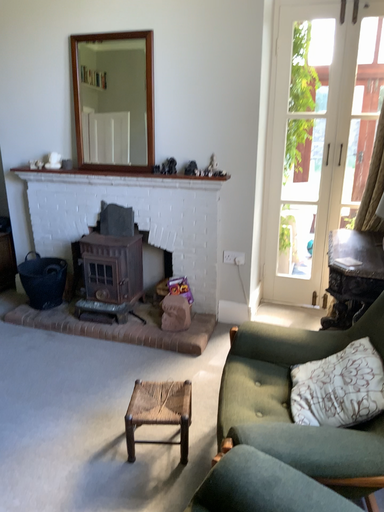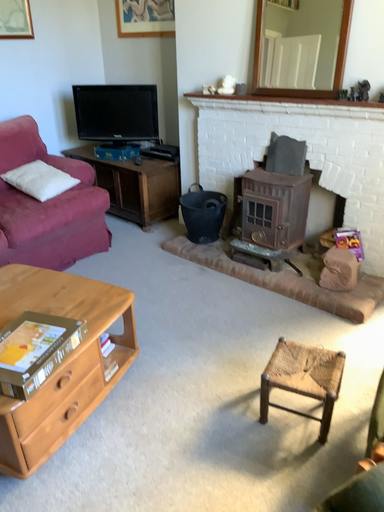
Question: Which way did the camera rotate in the video?

Choices:
 (A) rotated right
 (B) rotated left

Answer: (B)